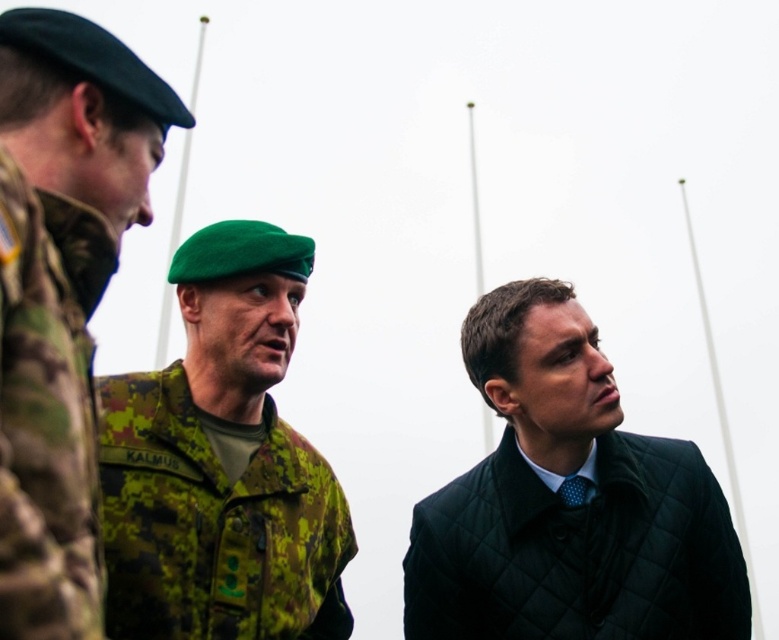
Question: Which object appears closest to the camera in this image?

Choices:
 (A) camouflage uniform at left
 (B) quilted dark green coat at center

Answer: (A)

Question: Does quilted dark green coat at center have a larger size compared to camouflage fabric uniform at center?

Choices:
 (A) no
 (B) yes

Answer: (B)

Question: Which object is closer to the camera taking this photo?

Choices:
 (A) camo fabric uniform at left
 (B) camouflage fabric uniform at center

Answer: (A)

Question: Does quilted dark green coat at center have a larger size compared to camouflage uniform at left?

Choices:
 (A) no
 (B) yes

Answer: (B)

Question: From the image, what is the correct spatial relationship of camouflage fabric uniform at center in relation to camo fabric uniform at left?

Choices:
 (A) right
 (B) left

Answer: (A)

Question: Which point is closer to the camera taking this photo?

Choices:
 (A) (696, 524)
 (B) (37, 388)
 (C) (210, 500)
 (D) (25, 356)

Answer: (B)